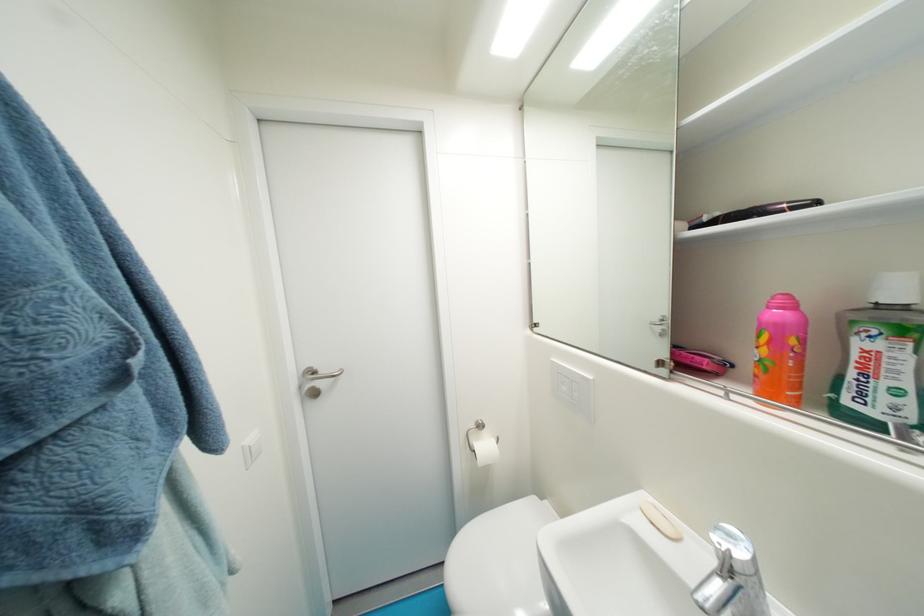
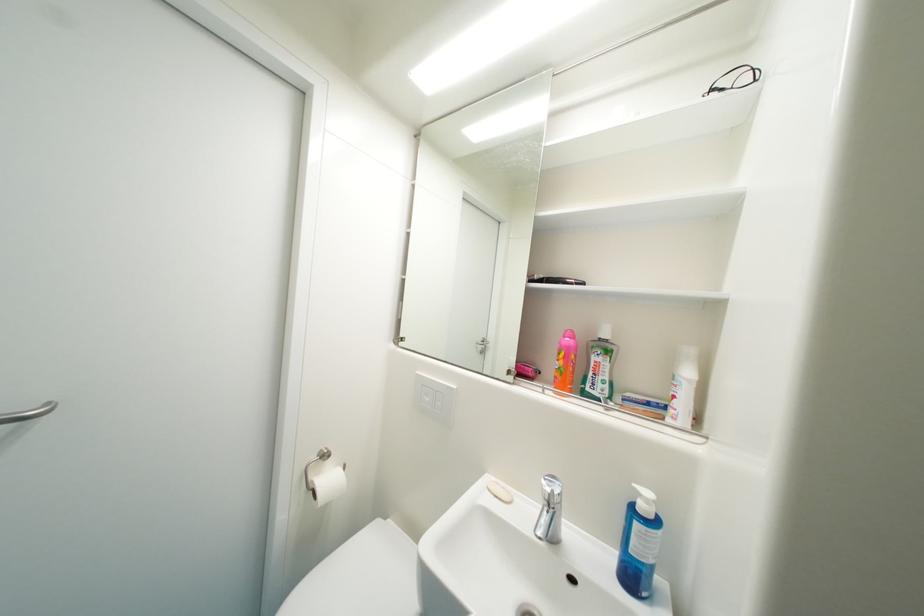
Locate, in the second image, the point that corresponds to [570,390] in the first image.

(433, 400)